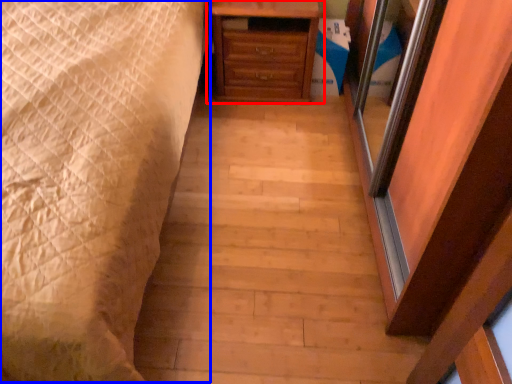
Question: Which object appears farthest to the camera in this image, chest of drawers (highlighted by a red box) or bed (highlighted by a blue box)?

Choices:
 (A) chest of drawers
 (B) bed

Answer: (A)